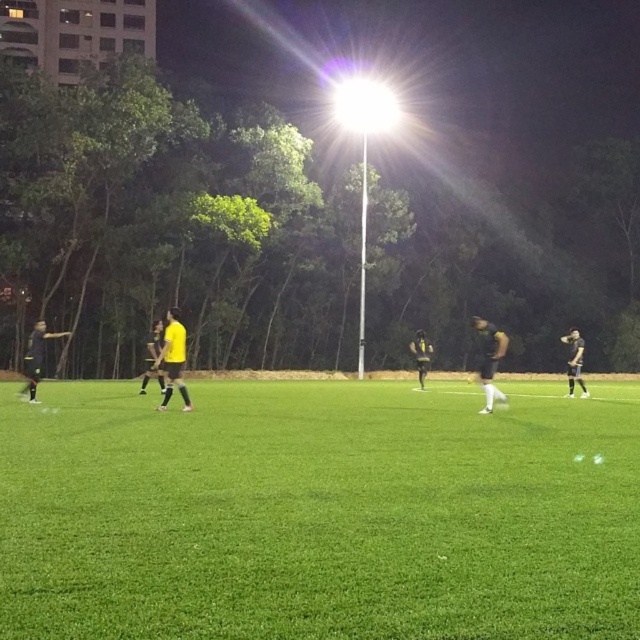
Does yellow matte jersey at center have a lesser width compared to black matte jersey at center?

In fact, yellow matte jersey at center might be wider than black matte jersey at center.

Measure the distance between yellow matte jersey at center and camera.

yellow matte jersey at center and camera are 13.76 meters apart from each other.

Between point (177, 339) and point (417, 356), which one is positioned in front?

Point (177, 339) is in front.

Identify the location of yellow matte jersey at center. The height and width of the screenshot is (640, 640). (173, 358).

Which is more to the right, green artificial turf at center or black matte soccer player at right?

Positioned to the right is black matte soccer player at right.

Where is `green artificial turf at center`? green artificial turf at center is located at coordinates (320, 513).

What are the coordinates of `green artificial turf at center` in the screenshot? It's located at (320, 513).

Who is more forward, [168,317] or [570,340]?

Point [570,340] is in front.

Which is above, yellow matte jersey at center or black matte soccer player at right?

Positioned higher is yellow matte jersey at center.

Identify the location of yellow matte jersey at center. (173, 358).